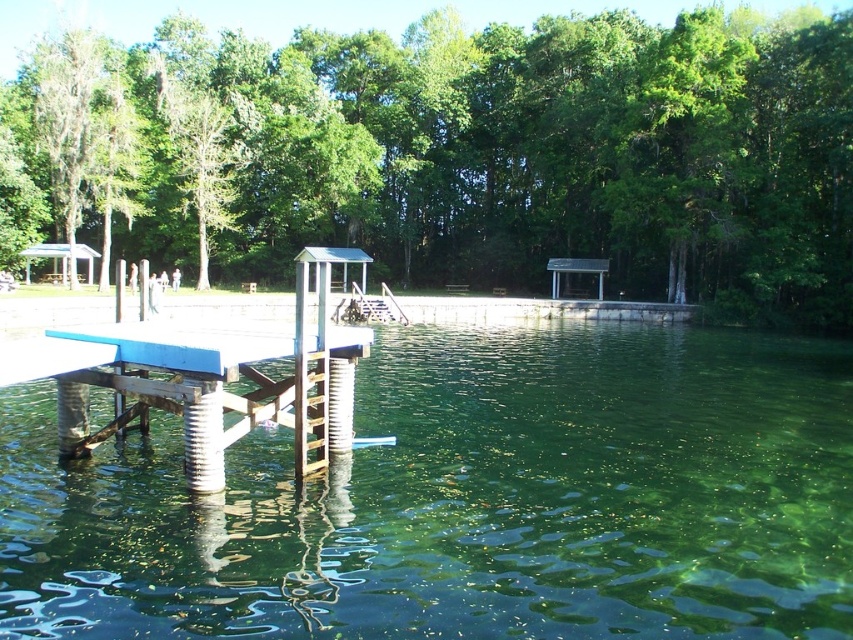
Does green leafy tree at center have a greater height compared to blue painted wood picnic table at center?

Yes.

Between point (550, 202) and point (109, 342), which one is positioned in front?

Point (109, 342) is in front.

Identify the location of green leafy tree at center. This screenshot has width=853, height=640. (459, 154).

Does point (308, 512) come farther from viewer compared to point (136, 356)?

Yes, it is.

Does point (161, 499) come closer to viewer compared to point (323, 460)?

Yes, point (161, 499) is in front of point (323, 460).

Is point (641, 364) farther from viewer compared to point (303, 440)?

Yes, it is behind point (303, 440).

Where is `green translucent water at center`? This screenshot has width=853, height=640. green translucent water at center is located at coordinates (467, 499).

Who is more distant from viewer, (751,412) or (686,225)?

Positioned behind is point (686,225).

Between point (608, 458) and point (270, 230), which one is positioned in front?

Point (608, 458) is more forward.

What are the coordinates of `green translucent water at center` in the screenshot? It's located at (467, 499).